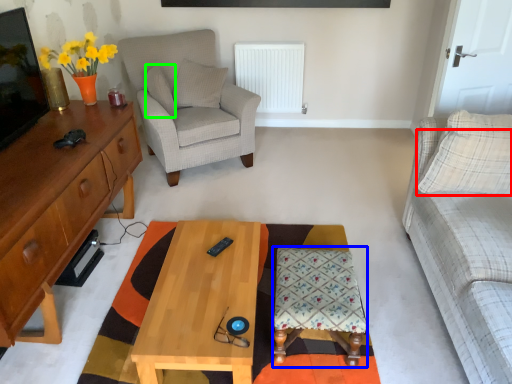
Question: Which is nearer to the pillow (highlighted by a red box)? stool (highlighted by a blue box) or pillow (highlighted by a green box).

Choices:
 (A) stool
 (B) pillow

Answer: (A)